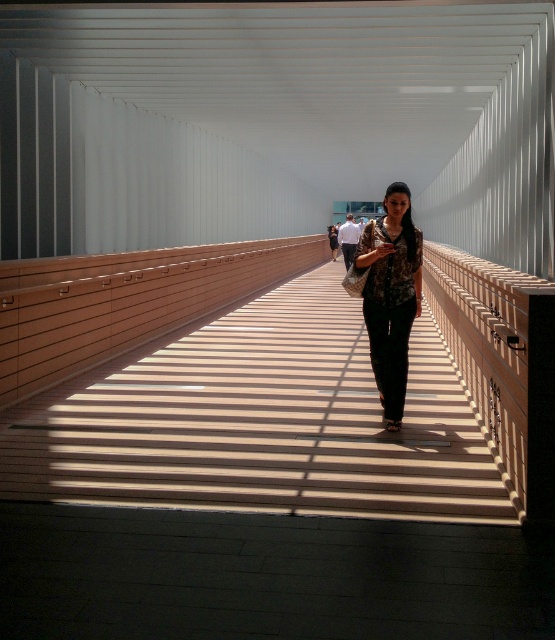
Does wooden bridge at center have a larger size compared to floral fabric dress at center?

Correct, wooden bridge at center is larger in size than floral fabric dress at center.

Does wooden bridge at center appear under floral fabric dress at center?

Yes, wooden bridge at center is below floral fabric dress at center.

Does point (256, 401) lie in front of point (387, 330)?

No, (256, 401) is behind (387, 330).

You are a GUI agent. You are given a task and a screenshot of the screen. Output one action in this format:
    pyautogui.click(x=<x>, y=<y>)
    Task: Click on the wooden bridge at center
    
    Given the screenshot: What is the action you would take?
    pyautogui.click(x=260, y=420)